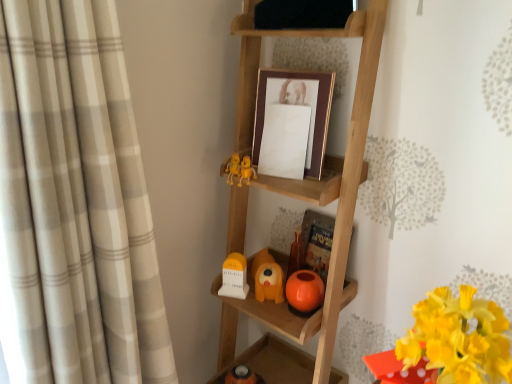
Question: Is yellow matte flower at lower right thinner than white matte clock at lower center, acting as the 2th toy starting from the right?

Choices:
 (A) no
 (B) yes

Answer: (A)

Question: Considering the relative sizes of yellow matte flower at lower right and white matte clock at lower center, which is the first toy in left-to-right order, in the image provided, is yellow matte flower at lower right shorter than white matte clock at lower center, which is the first toy in left-to-right order,?

Choices:
 (A) yes
 (B) no

Answer: (B)

Question: Considering the relative sizes of yellow matte flower at lower right and white matte clock at lower center, acting as the 2th toy starting from the right, in the image provided, is yellow matte flower at lower right taller than white matte clock at lower center, acting as the 2th toy starting from the right,?

Choices:
 (A) no
 (B) yes

Answer: (B)

Question: Is yellow matte flower at lower right to the left of white matte clock at lower center, acting as the 2th toy starting from the right, from the viewer's perspective?

Choices:
 (A) no
 (B) yes

Answer: (A)

Question: Considering the relative sizes of yellow matte flower at lower right and white matte clock at lower center, which is the first toy in left-to-right order, in the image provided, is yellow matte flower at lower right smaller than white matte clock at lower center, which is the first toy in left-to-right order,?

Choices:
 (A) yes
 (B) no

Answer: (B)

Question: From a real-world perspective, relative to gold/maroon picture frame at center, is wooden ladder at center, which is the 1th shelf in bottom-to-top order, vertically above or below?

Choices:
 (A) below
 (B) above

Answer: (A)

Question: Is wooden ladder at center, which is the 1th shelf in bottom-to-top order, wider or thinner than gold/maroon picture frame at center?

Choices:
 (A) wide
 (B) thin

Answer: (A)

Question: Is point (230, 210) closer or farther from the camera than point (273, 97)?

Choices:
 (A) closer
 (B) farther

Answer: (B)

Question: Is wooden ladder at center, the second shelf viewed from the top, inside the boundaries of gold/maroon picture frame at center, or outside?

Choices:
 (A) outside
 (B) inside

Answer: (A)

Question: Is white matte clock at lower center, acting as the 2th toy starting from the right, to the left or to the right of yellow matte flower at lower right in the image?

Choices:
 (A) left
 (B) right

Answer: (A)

Question: From a real-world perspective, is white matte clock at lower center, acting as the 2th toy starting from the right, physically located above or below yellow matte flower at lower right?

Choices:
 (A) above
 (B) below

Answer: (B)

Question: Is point pos(230,276) positioned closer to the camera than point pos(448,360)?

Choices:
 (A) closer
 (B) farther

Answer: (B)

Question: From the image's perspective, is white matte clock at lower center, acting as the 2th toy starting from the right, positioned above or below yellow matte flower at lower right?

Choices:
 (A) above
 (B) below

Answer: (A)

Question: From the image's perspective, relative to beige plaid curtain at left, is white matte clock at lower center, which is the first toy in left-to-right order, above or below?

Choices:
 (A) above
 (B) below

Answer: (B)

Question: In terms of size, does white matte clock at lower center, which is the first toy in left-to-right order, appear bigger or smaller than beige plaid curtain at left?

Choices:
 (A) big
 (B) small

Answer: (B)